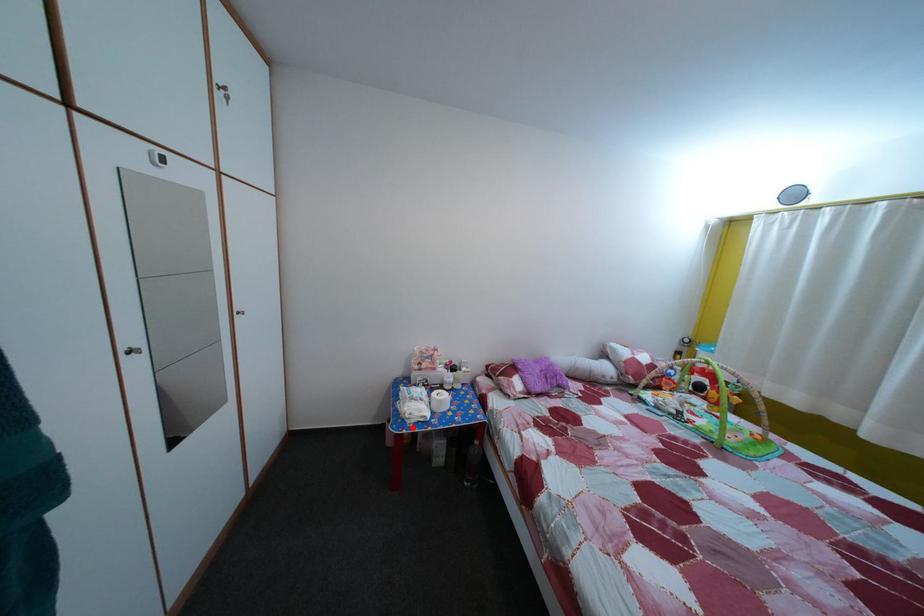
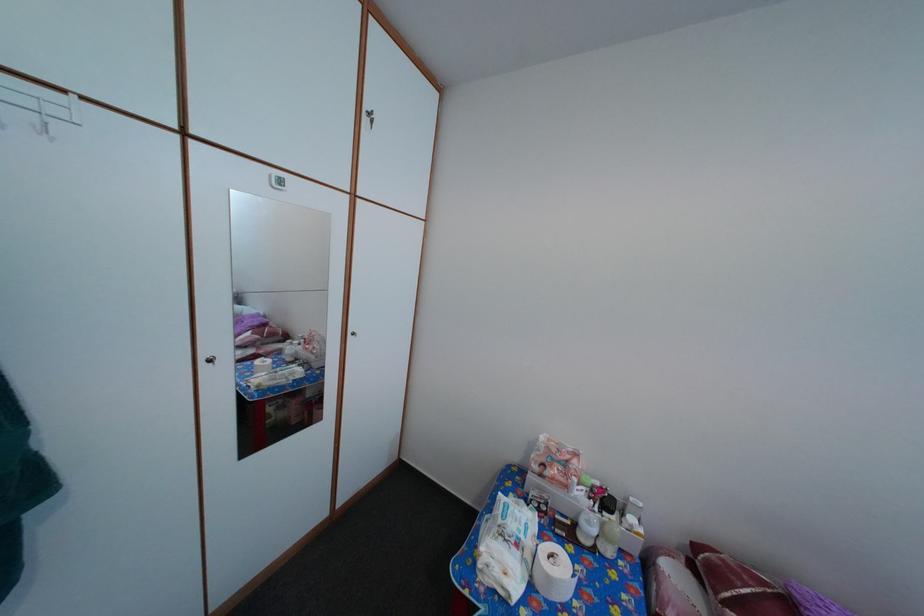
Find the pixel in the second image that matches the highlighted location in the first image.

(484, 572)